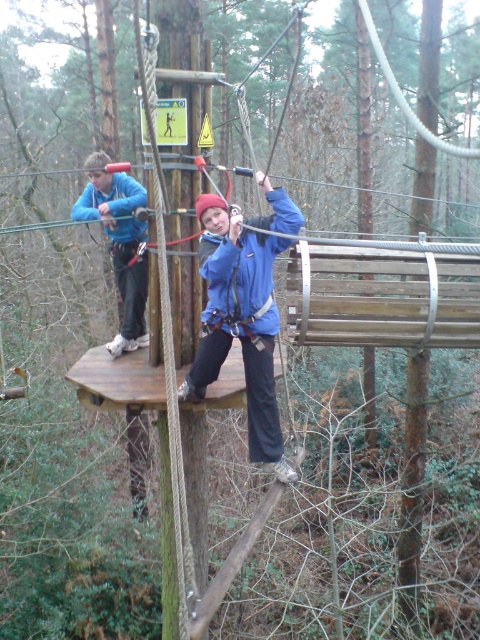
You are an instructor observing two participants on a high ropes course. You notice both are wearing jackets labeled as blue fabric jacket at center and matte blue jacket at center. Which participant has a wider jacket?

The blue fabric jacket at center is wider than the matte blue jacket at center, so the participant wearing the blue fabric jacket at center has a wider jacket.

You are an observer at the ropes course. You notice two people wearing blue jackets on the platform. Which one is positioned to the right when looking at the blue fabric jacket at center and the matte blue jacket at center?

The blue fabric jacket at center is positioned to the right of the matte blue jacket at center.

You are standing at the point labeled point (240, 323) in the image. What object is located at that point?

The point (240, 323) corresponds to the blue fabric jacket at center.